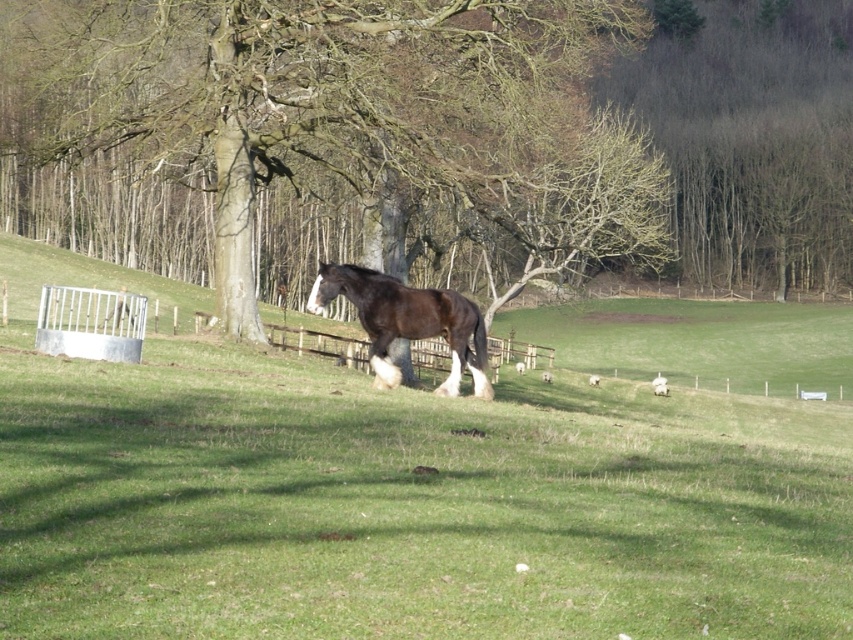
Is brown bark tree at center below brown glossy horse at center?

Actually, brown bark tree at center is above brown glossy horse at center.

Who is taller, brown bark tree at center or brown glossy horse at center?

With more height is brown bark tree at center.

The height and width of the screenshot is (640, 853). What do you see at coordinates (318, 102) in the screenshot? I see `brown bark tree at center` at bounding box center [318, 102].

Locate an element on the screen. This screenshot has height=640, width=853. brown bark tree at center is located at coordinates (318, 102).